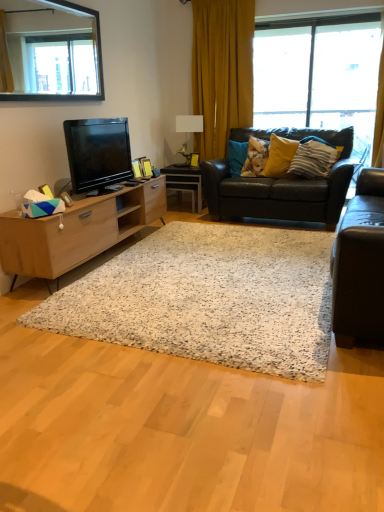
Question: Is black glass mirror at upper left taller than yellow matte pillow at upper right, which is the second pillow in right-to-left order?

Choices:
 (A) yes
 (B) no

Answer: (A)

Question: Is black glass mirror at upper left smaller than yellow matte pillow at upper right, which is the second pillow in right-to-left order?

Choices:
 (A) yes
 (B) no

Answer: (B)

Question: Does black glass mirror at upper left appear on the left side of yellow matte pillow at upper right, which is the second pillow in right-to-left order?

Choices:
 (A) no
 (B) yes

Answer: (B)

Question: Does black glass mirror at upper left touch yellow matte pillow at upper right, which is the second pillow in right-to-left order?

Choices:
 (A) no
 (B) yes

Answer: (A)

Question: Is black glass mirror at upper left further to camera compared to yellow matte pillow at upper right, which is the second pillow in right-to-left order?

Choices:
 (A) no
 (B) yes

Answer: (A)

Question: Visually, is leather couch at right, acting as the first studio couch starting from the front, positioned to the left or to the right of leather couch at center, arranged as the second studio couch when viewed from the front?

Choices:
 (A) right
 (B) left

Answer: (A)

Question: From a real-world perspective, is leather couch at right, the second studio couch positioned from the back, physically located above or below leather couch at center, arranged as the second studio couch when viewed from the front?

Choices:
 (A) below
 (B) above

Answer: (A)

Question: Looking at their shapes, would you say leather couch at right, acting as the first studio couch starting from the front, is wider or thinner than leather couch at center, marked as the first studio couch in a back-to-front arrangement?

Choices:
 (A) wide
 (B) thin

Answer: (B)

Question: In the image, is leather couch at right, acting as the first studio couch starting from the front, positioned in front of or behind leather couch at center, marked as the first studio couch in a back-to-front arrangement?

Choices:
 (A) front
 (B) behind

Answer: (A)

Question: In terms of width, does yellow fabric curtain at upper center look wider or thinner when compared to white glossy lamp at upper center?

Choices:
 (A) wide
 (B) thin

Answer: (B)

Question: From a real-world perspective, is yellow fabric curtain at upper center positioned above or below white glossy lamp at upper center?

Choices:
 (A) above
 (B) below

Answer: (A)

Question: Is yellow fabric curtain at upper center in front of or behind white glossy lamp at upper center in the image?

Choices:
 (A) front
 (B) behind

Answer: (A)

Question: From their relative heights in the image, would you say yellow fabric curtain at upper center is taller or shorter than white glossy lamp at upper center?

Choices:
 (A) short
 (B) tall

Answer: (B)

Question: Considering the positions of black glass mirror at upper left and yellow matte pillow at upper right, which is the second pillow in right-to-left order, in the image, is black glass mirror at upper left taller or shorter than yellow matte pillow at upper right, which is the second pillow in right-to-left order,?

Choices:
 (A) short
 (B) tall

Answer: (B)

Question: Is black glass mirror at upper left in front of or behind yellow matte pillow at upper right, which is the second pillow in right-to-left order, in the image?

Choices:
 (A) front
 (B) behind

Answer: (A)